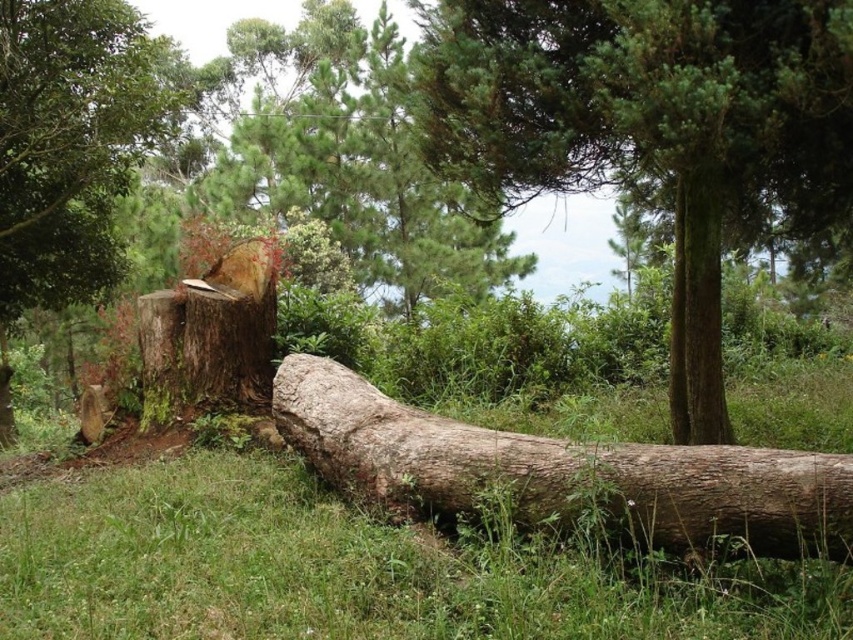
In the scene shown: Does green rough bark tree at center have a greater width compared to brown rough wood stump at center?

Indeed, green rough bark tree at center has a greater width compared to brown rough wood stump at center.

Can you confirm if green rough bark tree at center is positioned to the left of brown rough wood stump at center?

Incorrect, green rough bark tree at center is not on the left side of brown rough wood stump at center.

Who is more forward, (x=788, y=192) or (x=259, y=404)?

Point (x=788, y=192)

Identify the location of green rough bark tree at center. pos(648,131).

Who is more distant from viewer, (317, 442) or (177, 321)?

The point (177, 321) is more distant.

Is point (762, 497) closer to viewer compared to point (270, 401)?

That is True.

Image resolution: width=853 pixels, height=640 pixels. What do you see at coordinates (560, 472) in the screenshot?
I see `brown rough log at center` at bounding box center [560, 472].

You are a GUI agent. You are given a task and a screenshot of the screen. Output one action in this format:
    pyautogui.click(x=<x>, y=<y>)
    Task: Click on the brown rough log at center
    The image size is (853, 640).
    Given the screenshot: What is the action you would take?
    pyautogui.click(x=560, y=472)

Can you confirm if brown rough log at center is smaller than green rough bark tree trunk at right?

Actually, brown rough log at center might be larger than green rough bark tree trunk at right.

Who is lower down, brown rough log at center or green rough bark tree trunk at right?

brown rough log at center is below.

Locate an element on the screen. brown rough log at center is located at coordinates (560, 472).

The width and height of the screenshot is (853, 640). I want to click on brown rough log at center, so click(x=560, y=472).